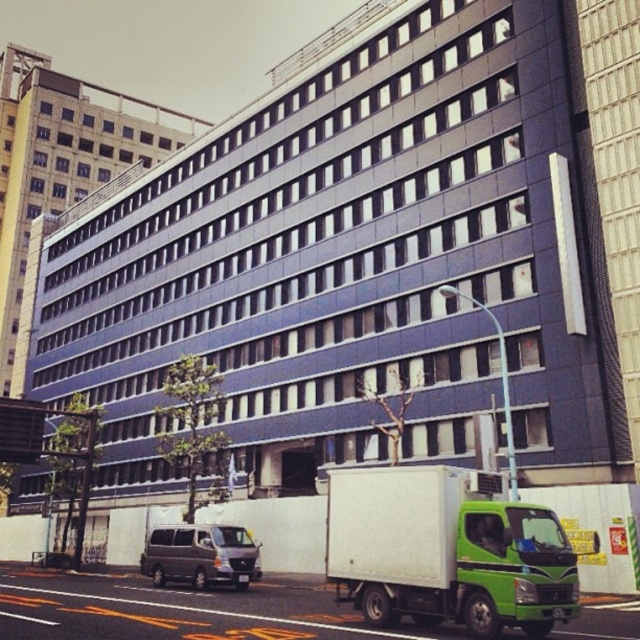
Question: Which point appears farthest from the camera in this image?

Choices:
 (A) (369, 540)
 (B) (144, 556)

Answer: (B)

Question: Which of the following is the closest to the observer?

Choices:
 (A) metallic gray van at lower left
 (B) green matte truck at lower right

Answer: (B)

Question: Is green matte truck at lower right to the right of metallic gray van at lower left from the viewer's perspective?

Choices:
 (A) yes
 (B) no

Answer: (A)

Question: Is green matte truck at lower right above metallic gray van at lower left?

Choices:
 (A) no
 (B) yes

Answer: (B)

Question: Can you confirm if green matte truck at lower right is thinner than metallic gray van at lower left?

Choices:
 (A) yes
 (B) no

Answer: (A)